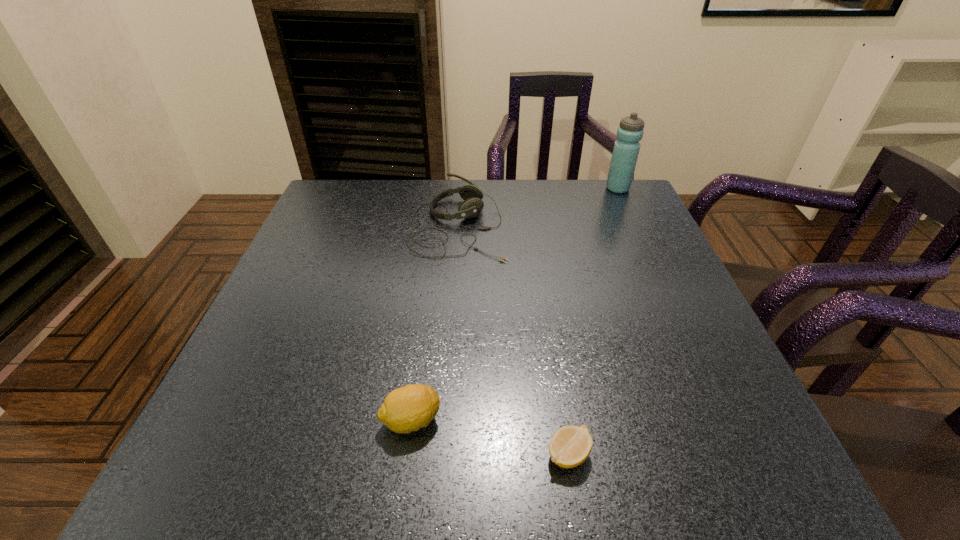
At what (x,y) coordinates should I click in order to perform the action: click on water bottle. Please return your answer as a coordinate pair (x, y). Looking at the image, I should click on (626, 149).

The width and height of the screenshot is (960, 540). I want to click on the farthest object, so click(626, 149).

Locate an element on the screen. headset is located at coordinates (472, 205).

Locate an element on the screen. the taller lemon is located at coordinates (406, 409).

Identify the location of the third object from left to right. (570, 446).

Where is `the shorter lemon`? The width and height of the screenshot is (960, 540). the shorter lemon is located at coordinates (570, 446).

Where is `vacant space located on the front of the farthest object`? The width and height of the screenshot is (960, 540). vacant space located on the front of the farthest object is located at coordinates (656, 270).

This screenshot has height=540, width=960. Identify the location of vacant space located 0.140m on the outer surface of the headset. (562, 226).

Where is `blank area located 0.070m at the stem end of the left lemon`? The image size is (960, 540). blank area located 0.070m at the stem end of the left lemon is located at coordinates (485, 420).

The image size is (960, 540). Identify the location of vacant space located on the left of the shorter lemon. (474, 454).